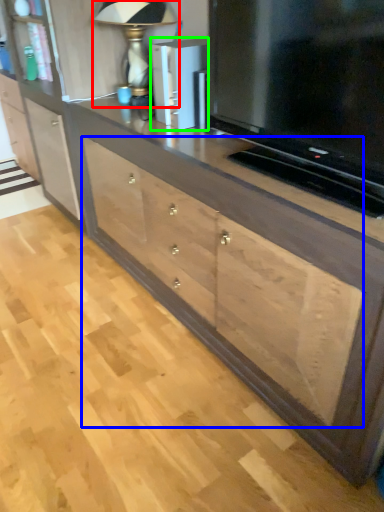
Question: Estimate the real-world distances between objects in this image. Which object is closer to table lamp (highlighted by a red box), drawer (highlighted by a blue box) or appliance (highlighted by a green box)?

Choices:
 (A) drawer
 (B) appliance

Answer: (B)